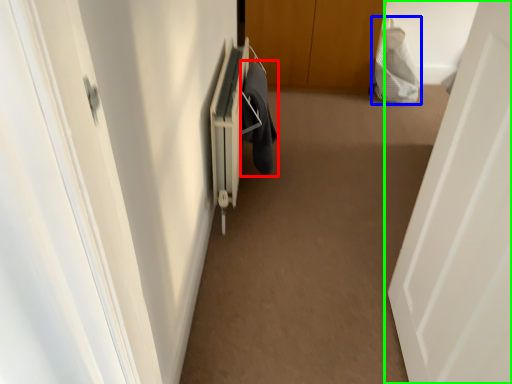
Question: Estimate the real-world distances between objects in this image. Which object is closer to laundry (highlighted by a red box), material (highlighted by a blue box) or door (highlighted by a green box)?

Choices:
 (A) material
 (B) door

Answer: (B)